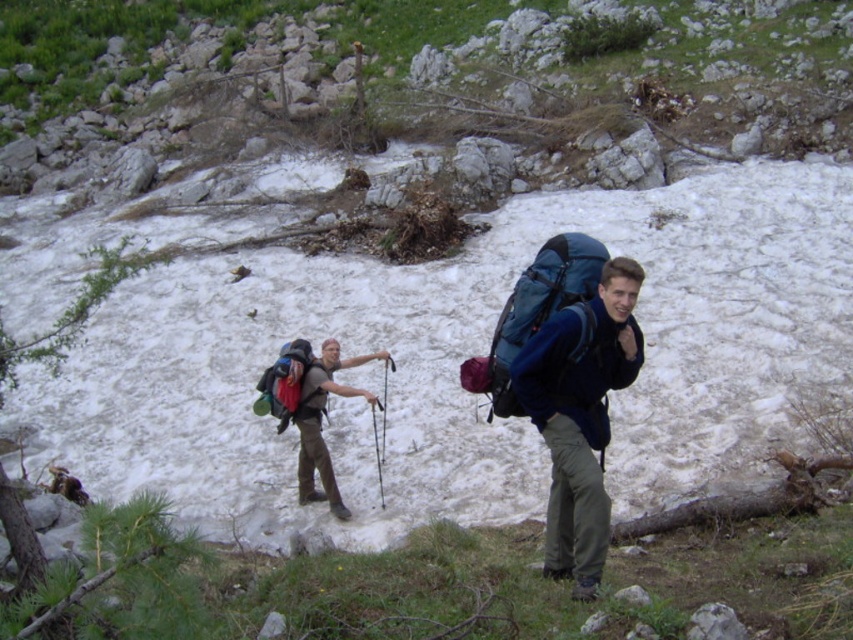
Does blue fabric backpack at right have a smaller size compared to matte black backpack at center?

A: Correct, blue fabric backpack at right occupies less space than matte black backpack at center.

You are a GUI agent. You are given a task and a screenshot of the screen. Output one action in this format:
    pyautogui.click(x=<x>, y=<y>)
    Task: Click on the blue fabric backpack at right
    This screenshot has height=640, width=853.
    Given the screenshot: What is the action you would take?
    pyautogui.click(x=579, y=416)

You are a GUI agent. You are given a task and a screenshot of the screen. Output one action in this format:
    pyautogui.click(x=<x>, y=<y>)
    Task: Click on the blue fabric backpack at right
    
    Given the screenshot: What is the action you would take?
    pyautogui.click(x=579, y=416)

Is teal fabric backpack at center to the right of matte black backpack at center from the viewer's perspective?

Yes, teal fabric backpack at center is to the right of matte black backpack at center.

Does teal fabric backpack at center appear over matte black backpack at center?

Correct, teal fabric backpack at center is located above matte black backpack at center.

Where is `teal fabric backpack at center`? Image resolution: width=853 pixels, height=640 pixels. teal fabric backpack at center is located at coordinates [x=543, y=307].

Who is more forward, (300, 468) or (268, 380)?

Point (268, 380)

Is matte black backpack at center taller than brushed metal backpack at center-left?

Correct, matte black backpack at center is much taller as brushed metal backpack at center-left.

Which is in front, point (331, 372) or point (306, 346)?

Point (306, 346)

You are a GUI agent. You are given a task and a screenshot of the screen. Output one action in this format:
    pyautogui.click(x=<x>, y=<y>)
    Task: Click on the matte black backpack at center
    The image size is (853, 640).
    Given the screenshot: What is the action you would take?
    pyautogui.click(x=320, y=422)